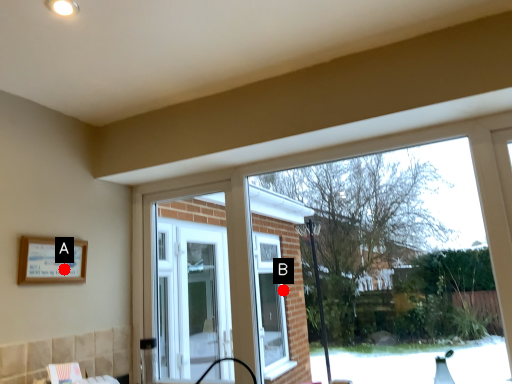
Question: Two points are circled on the image, labeled by A and B beside each circle. Which point appears closest to the camera in this image?

Choices:
 (A) A is closer
 (B) B is closer

Answer: (A)